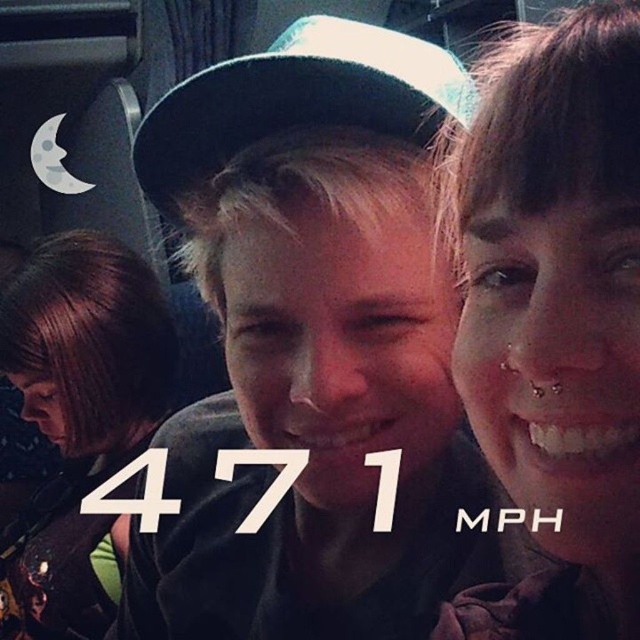
You are a photographer standing in the subway car. You want to take a photo of both the brown hair at lower left and the green fabric baseball cap at center. Can you fit both subjects into the frame of your camera, which has a minimum required distance of 12 inches between subjects to avoid blurring?

The distance between the brown hair at lower left and green fabric baseball cap at center is 11.88 inches, which is less than the 12 inches required to avoid blurring. Therefore, the subjects are too close to be captured clearly without blurring.